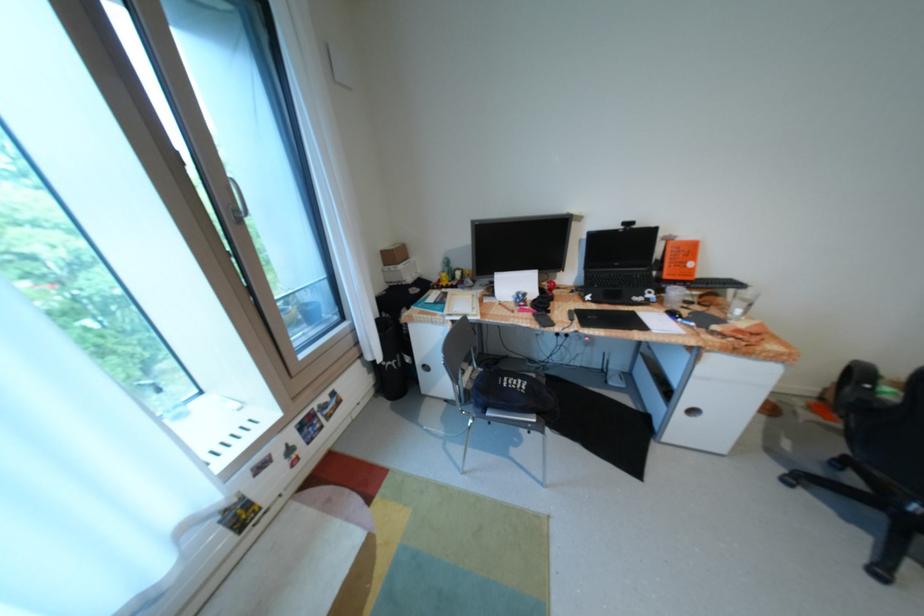
This screenshot has height=616, width=924. I want to click on silver window handle, so 238,197.